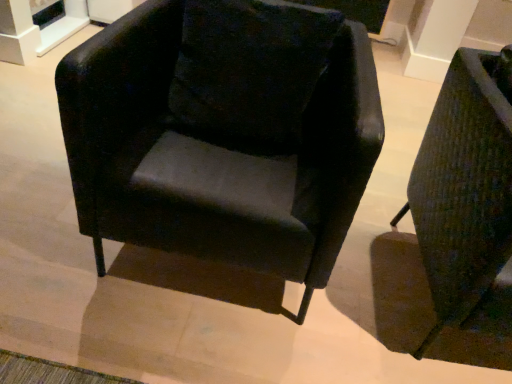
Question: Visually, is matte black armchair at center, arranged as the 1th chair when viewed from the left, positioned to the left or to the right of textured green fabric armchair at right, which is counted as the first chair, starting from the right?

Choices:
 (A) left
 (B) right

Answer: (A)

Question: Is point (200, 6) positioned closer to the camera than point (472, 54)?

Choices:
 (A) farther
 (B) closer

Answer: (B)

Question: Which object is the closest to the matte black armchair at center, arranged as the 1th chair when viewed from the left?

Choices:
 (A) textured green fabric armchair at right, which is counted as the first chair, starting from the right
 (B) velvet black pillow at center

Answer: (B)

Question: Estimate the real-world distances between objects in this image. Which object is closer to the velvet black pillow at center?

Choices:
 (A) matte black armchair at center, positioned as the 2th chair in right-to-left order
 (B) textured green fabric armchair at right, the 2th chair positioned from the left

Answer: (A)